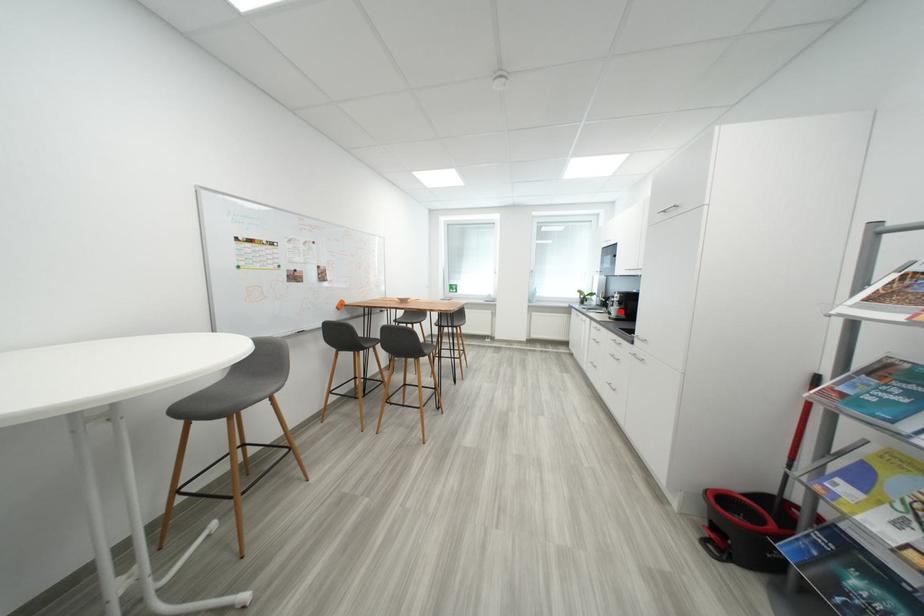
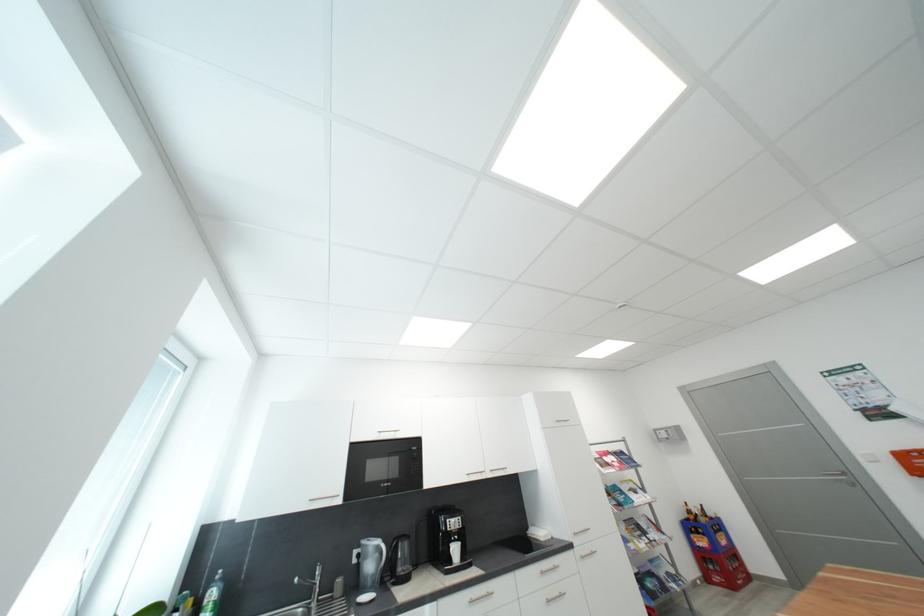
Question: I am providing you with two images of the same scene from different viewpoints. In image1, a red point is highlighted. Considering the same 3D point in image2, which of the following is correct?

Choices:
 (A) It is closer
 (B) It is farther

Answer: (B)